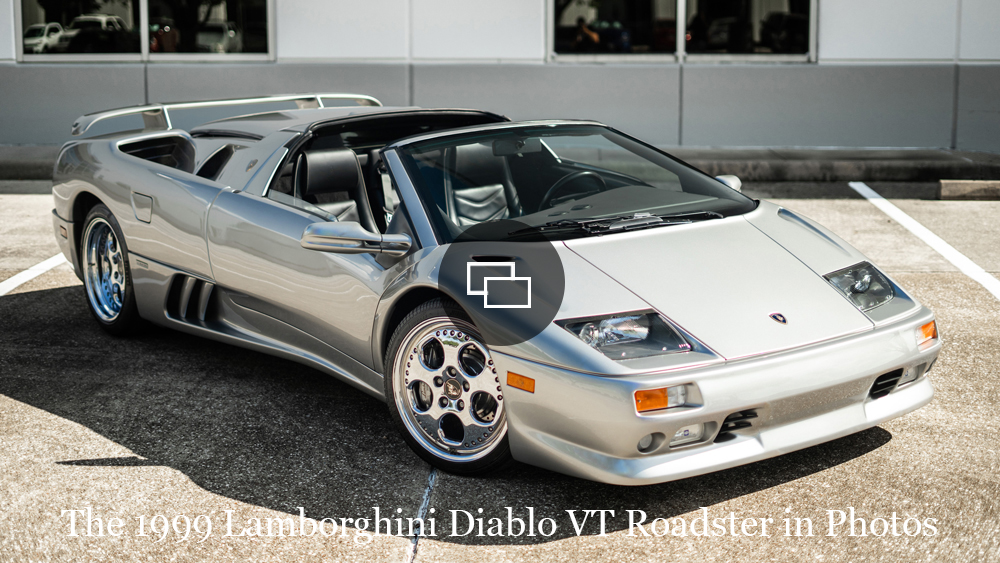
Identify the location of mirror. point(333,234).